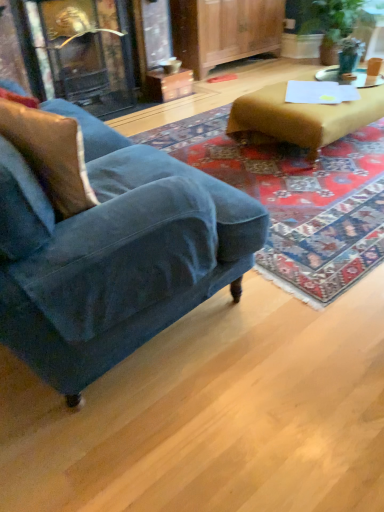
Question: From a real-world perspective, is teal glass at upper right on top of velvet brown pillow at left?

Choices:
 (A) no
 (B) yes

Answer: (A)

Question: Is teal glass at upper right turned away from velvet brown pillow at left?

Choices:
 (A) yes
 (B) no

Answer: (B)

Question: Considering the relative sizes of teal glass at upper right and velvet brown pillow at left in the image provided, is teal glass at upper right shorter than velvet brown pillow at left?

Choices:
 (A) yes
 (B) no

Answer: (A)

Question: Is teal glass at upper right positioned beyond the bounds of velvet brown pillow at left?

Choices:
 (A) yes
 (B) no

Answer: (A)

Question: Is the depth of teal glass at upper right less than that of velvet brown pillow at left?

Choices:
 (A) yes
 (B) no

Answer: (B)

Question: In terms of size, does velvet blue armchair at left appear bigger or smaller than white glossy side table at upper right?

Choices:
 (A) big
 (B) small

Answer: (A)

Question: In terms of height, does velvet blue armchair at left look taller or shorter compared to white glossy side table at upper right?

Choices:
 (A) short
 (B) tall

Answer: (B)

Question: Is velvet blue armchair at left to the left or to the right of white glossy side table at upper right in the image?

Choices:
 (A) right
 (B) left

Answer: (B)

Question: Is velvet blue armchair at left in front of or behind white glossy side table at upper right in the image?

Choices:
 (A) front
 (B) behind

Answer: (A)

Question: Is teal glass at upper right inside the boundaries of velvet blue couch at lower left, or outside?

Choices:
 (A) outside
 (B) inside

Answer: (A)

Question: Based on their sizes in the image, would you say teal glass at upper right is bigger or smaller than velvet blue couch at lower left?

Choices:
 (A) small
 (B) big

Answer: (A)

Question: Does point (349, 62) appear closer or farther from the camera than point (180, 254)?

Choices:
 (A) closer
 (B) farther

Answer: (B)

Question: Looking at their shapes, would you say teal glass at upper right is wider or thinner than velvet blue couch at lower left?

Choices:
 (A) wide
 (B) thin

Answer: (B)

Question: Considering the positions of velvet brown pillow at left and velvet blue couch at lower left in the image, is velvet brown pillow at left wider or thinner than velvet blue couch at lower left?

Choices:
 (A) thin
 (B) wide

Answer: (A)

Question: Is velvet brown pillow at left bigger or smaller than velvet blue couch at lower left?

Choices:
 (A) small
 (B) big

Answer: (A)